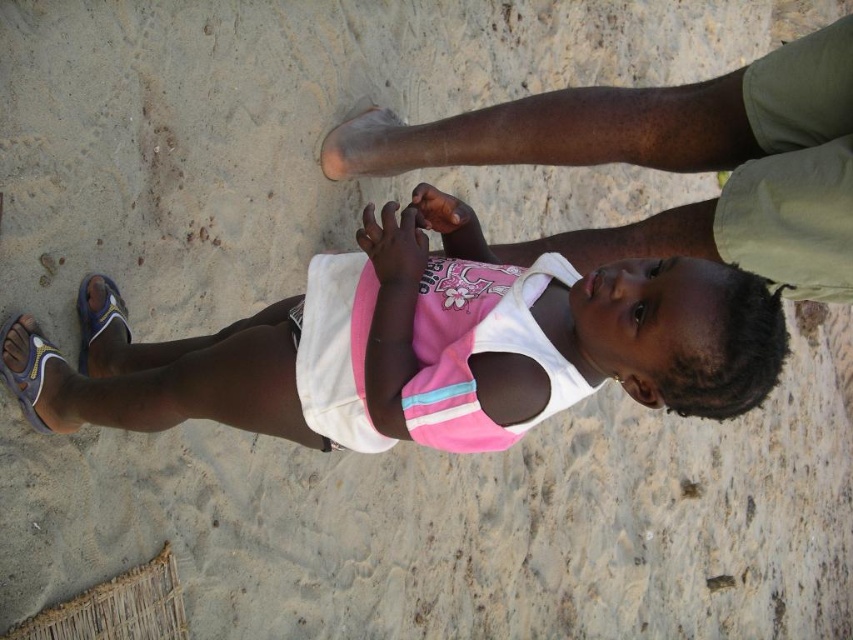
Can you confirm if green cotton shorts at upper right is positioned above yellow-green rubber sandal at lower left?

Indeed, green cotton shorts at upper right is positioned over yellow-green rubber sandal at lower left.

Between green cotton shorts at upper right and yellow-green rubber sandal at lower left, which one is positioned lower?

yellow-green rubber sandal at lower left is below.

I want to click on green cotton shorts at upper right, so click(x=672, y=161).

Where is `green cotton shorts at upper right`? The width and height of the screenshot is (853, 640). green cotton shorts at upper right is located at coordinates (672, 161).

Is point (703, 372) positioned behind point (79, 289)?

No, (703, 372) is closer to viewer.

Is point (416, 401) farther from camera compared to point (115, 292)?

No, (416, 401) is in front of (115, 292).

In order to click on pink fabric shirt at center in this screenshot , I will do `click(444, 344)`.

Between yellow-green rubber sandal at lower left and blue fabric sandal at lower left, which one is positioned lower?

yellow-green rubber sandal at lower left is lower down.

Between point (39, 332) and point (109, 312), which one is positioned behind?

Positioned behind is point (109, 312).

Which is behind, point (28, 362) or point (129, 339)?

The point (129, 339) is behind.

At what (x,y) coordinates should I click in order to perform the action: click on yellow-green rubber sandal at lower left. Please return your answer as a coordinate pair (x, y). The width and height of the screenshot is (853, 640). Looking at the image, I should click on (27, 372).